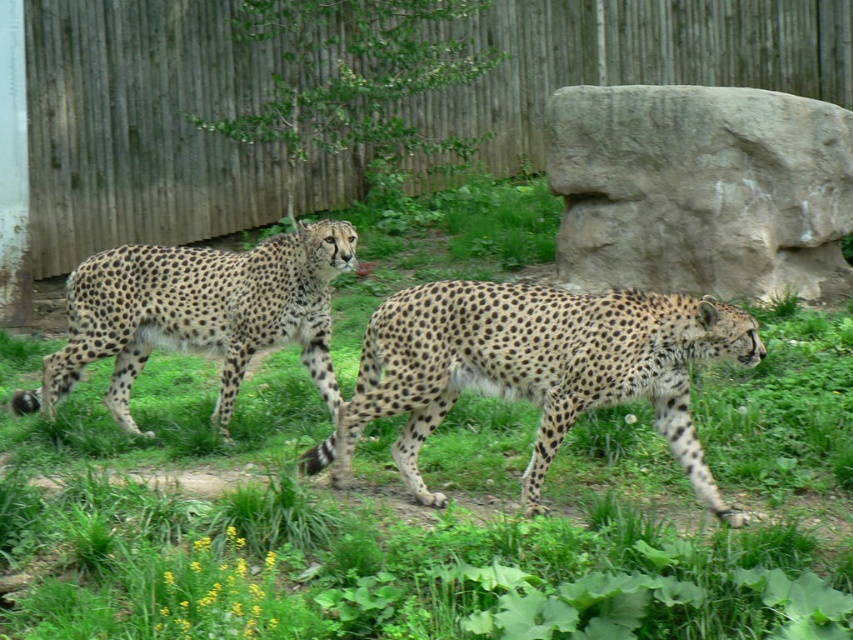
Can you confirm if spotted fur cheetah at center is thinner than spotted fur cheetah at left?

Yes, spotted fur cheetah at center is thinner than spotted fur cheetah at left.

Which is behind, point (524, 392) or point (212, 256)?

The point (212, 256) is more distant.

The image size is (853, 640). What are the coordinates of `spotted fur cheetah at center` in the screenshot? It's located at (535, 369).

Looking at this image, is gray stone boulder at right smaller than spotted fur cheetah at left?

No.

Is gray stone boulder at right to the right of spotted fur cheetah at left from the viewer's perspective?

Indeed, gray stone boulder at right is positioned on the right side of spotted fur cheetah at left.

Between point (642, 202) and point (277, 298), which one is positioned in front?

Positioned in front is point (277, 298).

This screenshot has width=853, height=640. Identify the location of gray stone boulder at right. (700, 189).

Can you confirm if gray stone boulder at right is taller than spotted fur cheetah at center?

Correct, gray stone boulder at right is much taller as spotted fur cheetah at center.

Looking at this image, how much distance is there between gray stone boulder at right and spotted fur cheetah at center?

gray stone boulder at right is 11.73 feet away from spotted fur cheetah at center.

Locate an element on the screen. This screenshot has height=640, width=853. gray stone boulder at right is located at coordinates (700, 189).